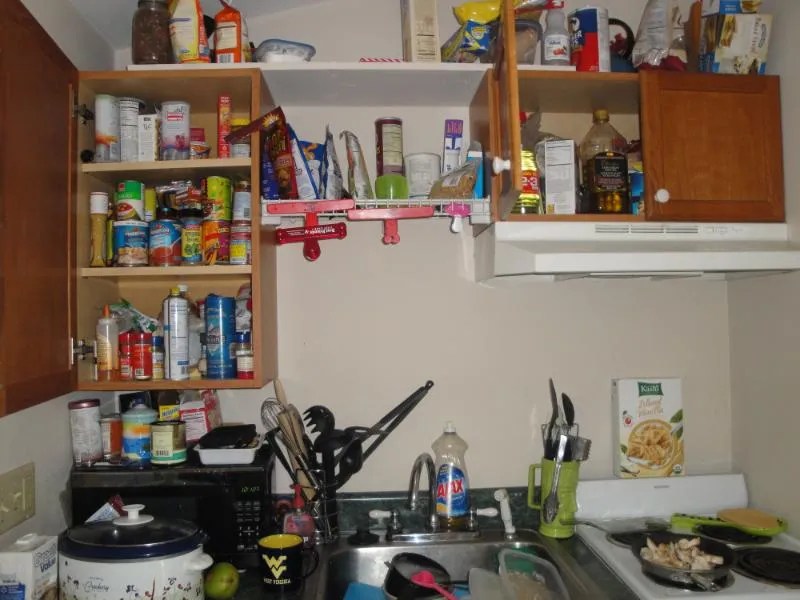
What are the coordinates of `burner` in the screenshot? It's located at (742, 545), (618, 543), (761, 570), (729, 581).